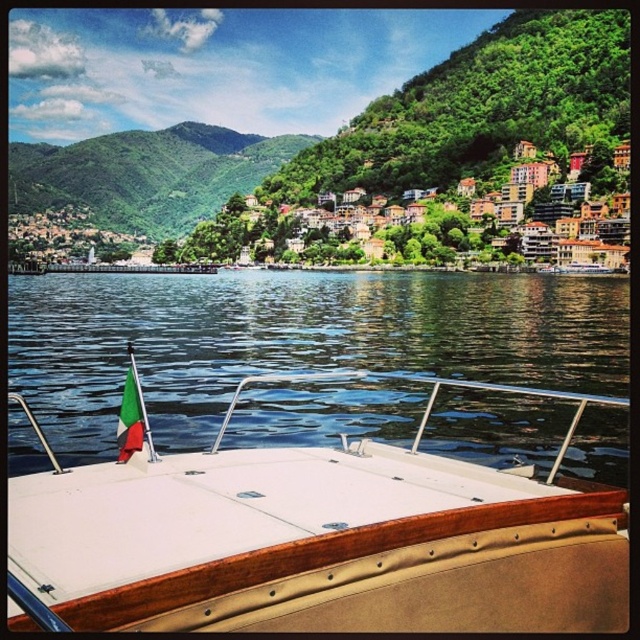
You are an observer on the boat deck. You see the green leafy hillside at upper left and the green fabric flag at center. Which object is positioned to the left of the other?

The green leafy hillside at upper left is to the left of the green fabric flag at center.